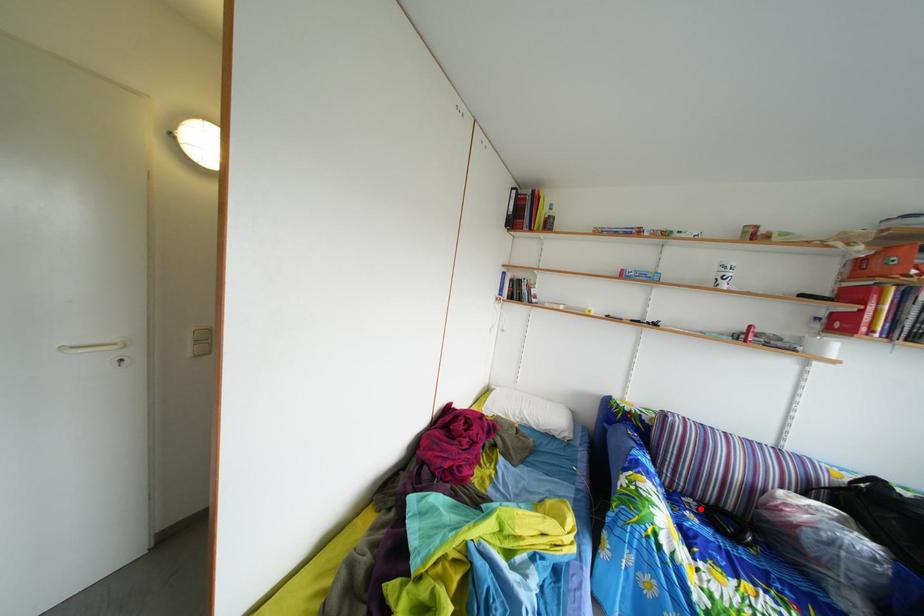
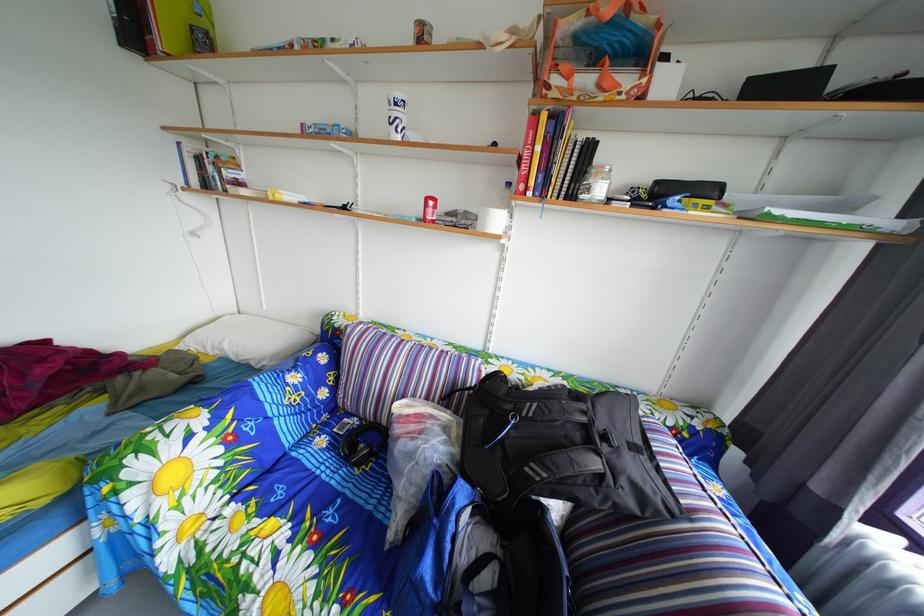
Question: I am providing you with two images of the same scene from different viewpoints. A red point is shown in image1. For the corresponding object point in image2, is it positioned nearer or farther from the camera?

Choices:
 (A) Nearer
 (B) Farther

Answer: (B)